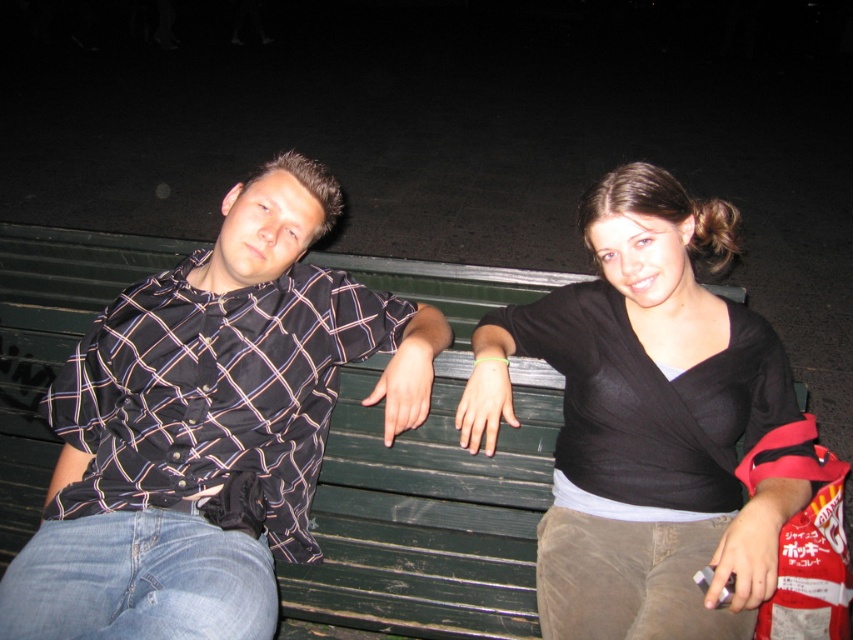
Question: Does matte black shirt at left appear over black matte shirt at center?

Choices:
 (A) yes
 (B) no

Answer: (B)

Question: Which object is closer to the camera taking this photo?

Choices:
 (A) matte black shirt at left
 (B) black matte shirt at center

Answer: (A)

Question: Which point is closer to the camera?

Choices:
 (A) black matte shirt at center
 (B) matte black shirt at left

Answer: (B)

Question: Is matte black shirt at left wider than black matte shirt at center?

Choices:
 (A) yes
 (B) no

Answer: (A)

Question: Considering the relative positions of matte black shirt at left and black matte shirt at center in the image provided, where is matte black shirt at left located with respect to black matte shirt at center?

Choices:
 (A) below
 (B) above

Answer: (A)